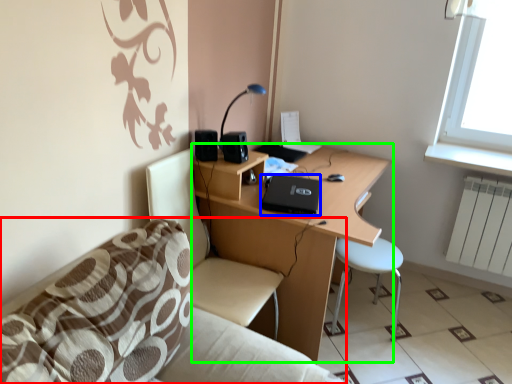
Question: Estimate the real-world distances between objects in this image. Which object is farther from studio couch (highlighted by a red box), laptop (highlighted by a blue box) or desk (highlighted by a green box)?

Choices:
 (A) laptop
 (B) desk

Answer: (A)